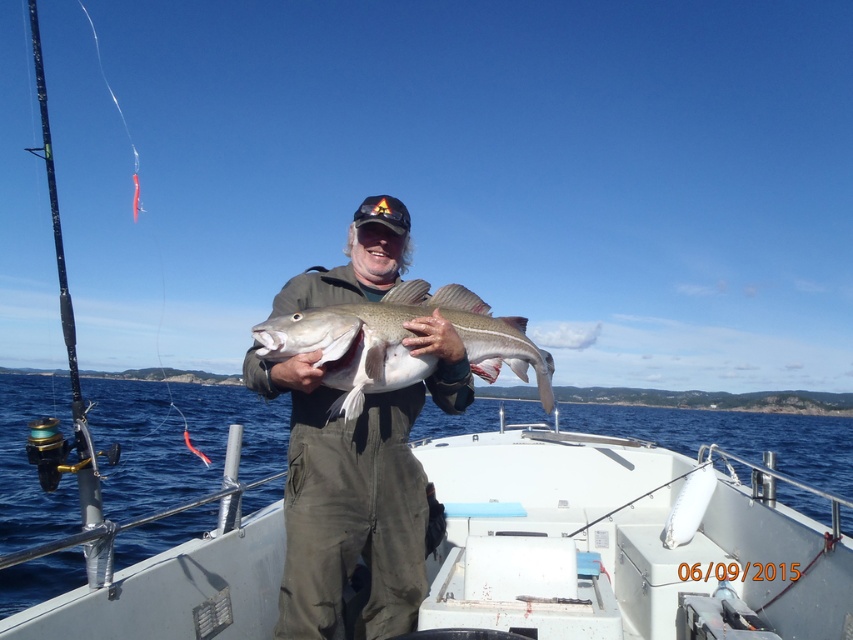
Question: From the image, what is the correct spatial relationship of white plastic boat at center in relation to dark green corduroy overalls at center?

Choices:
 (A) above
 (B) below

Answer: (B)

Question: Which of the following is the closest to the observer?

Choices:
 (A) (373, 388)
 (B) (769, 417)

Answer: (A)

Question: Which point is farther to the camera?

Choices:
 (A) (503, 316)
 (B) (520, 406)

Answer: (B)

Question: In this image, where is dark green corduroy overalls at center located relative to silver metallic fish at center?

Choices:
 (A) right
 (B) left

Answer: (B)

Question: Estimate the real-world distances between objects in this image. Which object is farther from the silver metallic fish at center?

Choices:
 (A) white plastic boat at center
 (B) dark green corduroy overalls at center

Answer: (A)

Question: Does white plastic boat at center have a greater width compared to silver metallic fish at center?

Choices:
 (A) no
 (B) yes

Answer: (B)